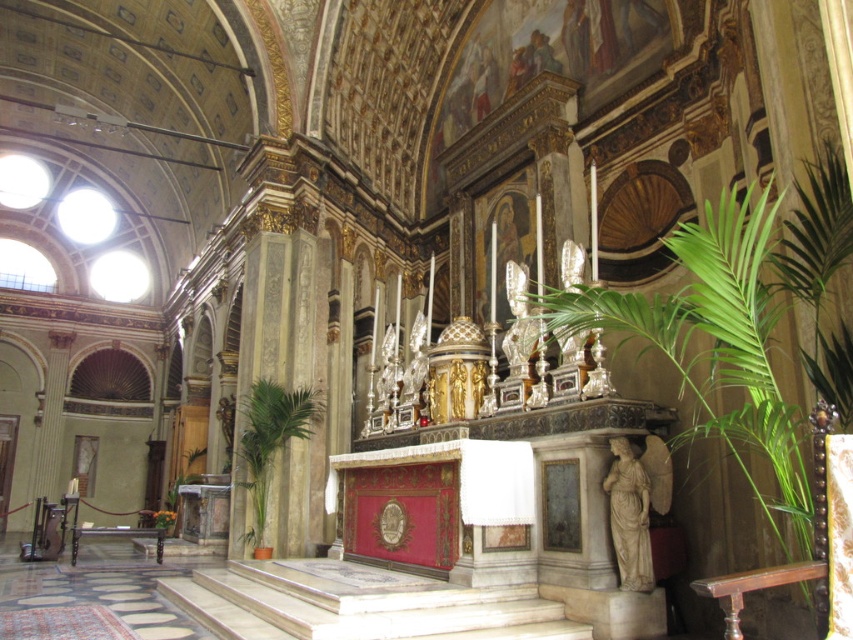
You are a visitor in the church and want to place a new small plant pot between the green leafy plant at right and the green leafy plant at lower left. Which side should you place it closer to to ensure it fits better?

You should place the new small plant pot closer to the green leafy plant at lower left because its width is smaller, leaving more space for the new pot to fit comfortably.

You are standing in the church and want to place a small statue on the floor near the green leafy plant at right. Based on the coordinates provided, where should you place the statue to ensure it is closest to the plant?

The green leafy plant at right is located at coordinates point (x=735, y=330), so you should place the statue near those coordinates to ensure it is closest to the plant.